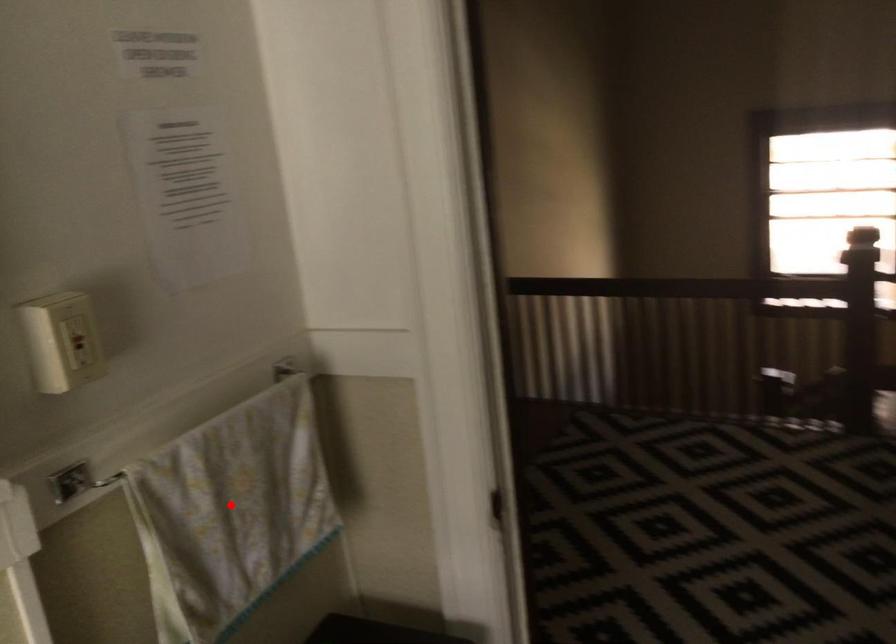
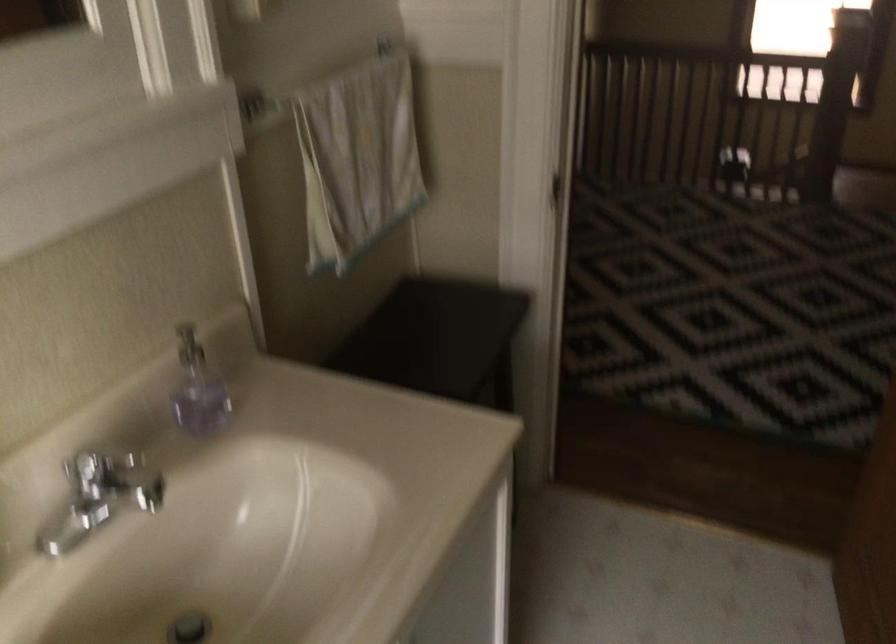
Find the pixel in the second image that matches the highlighted location in the first image.

(357, 158)